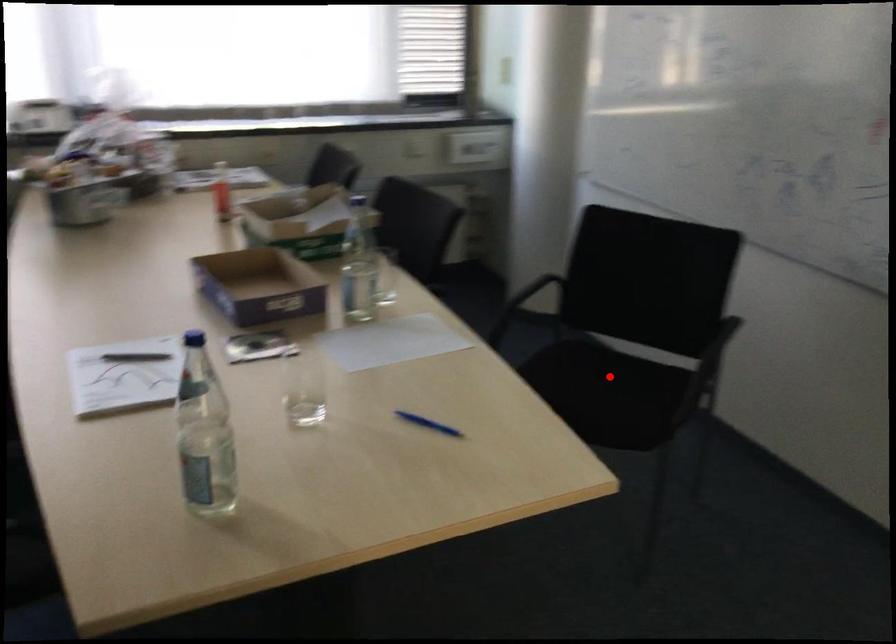
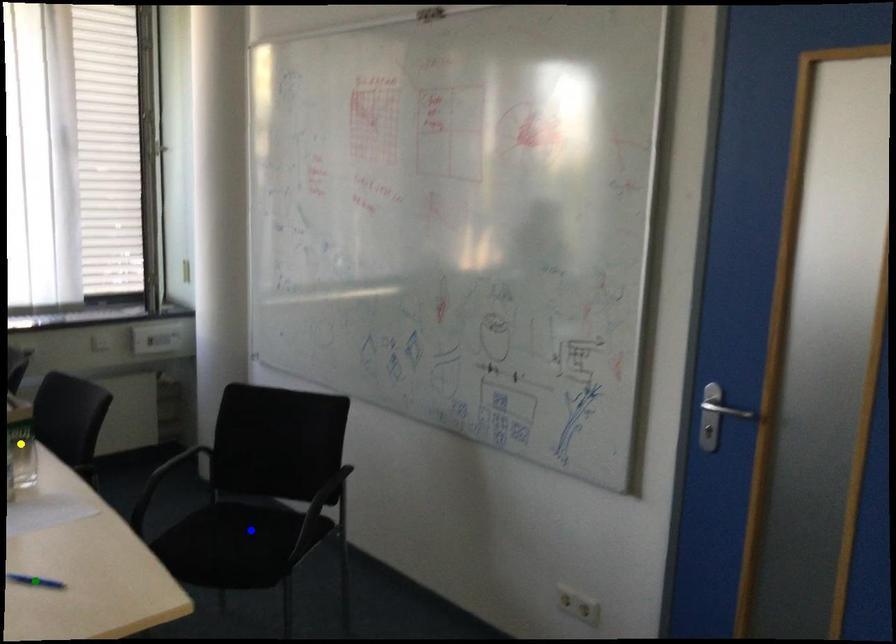
Question: I am providing you with two images of the same scene from different viewpoints. A red point is marked on the first image. You are given multiple points on the second image. Which point in image 2 is actually the same real-world point as the red point in image 1?

Choices:
 (A) yellow point
 (B) green point
 (C) blue point

Answer: (C)